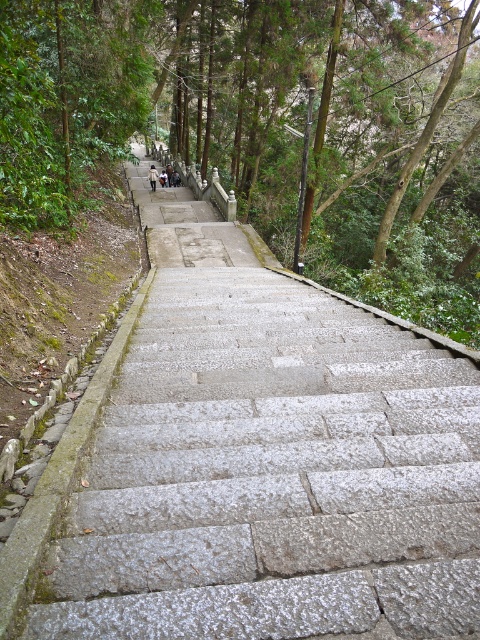
Question: Does gray stone stairs at center have a greater width compared to dark gray stone steps at upper center?

Choices:
 (A) no
 (B) yes

Answer: (B)

Question: Which is nearer to the green leafy tree at upper center?

Choices:
 (A) gray stone stairs at center
 (B) dark gray stone steps at upper center

Answer: (B)

Question: From the image, what is the correct spatial relationship of green leafy tree at upper center in relation to dark gray stone steps at upper center?

Choices:
 (A) right
 (B) left

Answer: (A)

Question: Does gray stone stairs at center appear on the left side of dark gray stone steps at upper center?

Choices:
 (A) no
 (B) yes

Answer: (A)

Question: Which object is positioned closest to the dark gray stone steps at upper center?

Choices:
 (A) gray stone stairs at center
 (B) green leafy tree at upper center

Answer: (B)

Question: Estimate the real-world distances between objects in this image. Which object is farther from the dark gray stone steps at upper center?

Choices:
 (A) gray stone stairs at center
 (B) green leafy tree at upper center

Answer: (A)